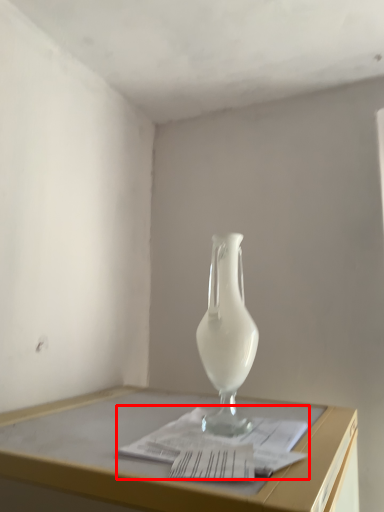
Question: In this image, where is magazine (annotated by the red box) located relative to vase?

Choices:
 (A) right
 (B) left

Answer: (B)